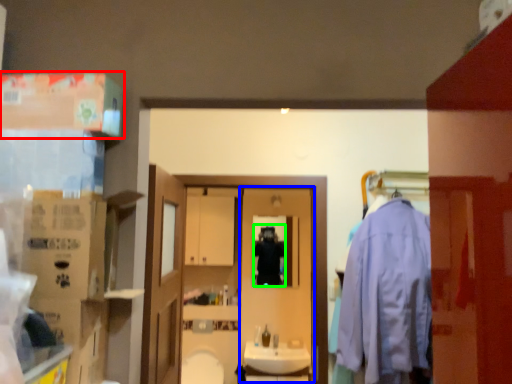
Question: Estimate the real-world distances between objects in this image. Which object is farther from box (highlighted by a red box), screen door (highlighted by a blue box) or person (highlighted by a green box)?

Choices:
 (A) screen door
 (B) person

Answer: (A)